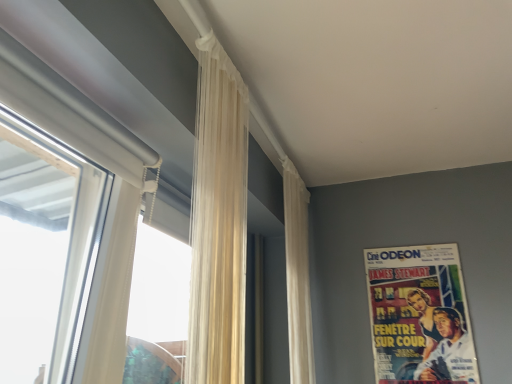
The height and width of the screenshot is (384, 512). Describe the element at coordinates (297, 276) in the screenshot. I see `white sheer curtain at upper center, which is the first curtain in right-to-left order` at that location.

This screenshot has width=512, height=384. I want to click on white matte window at left, so click(x=119, y=67).

Describe the element at coordinates (218, 221) in the screenshot. I see `translucent cream curtain at center, placed as the 1th curtain when sorted from front to back` at that location.

The image size is (512, 384). I want to click on translucent cream curtain at center, the first curtain positioned from the left, so click(x=218, y=221).

What do you see at coordinates (419, 315) in the screenshot? The height and width of the screenshot is (384, 512). I see `vintage paper poster at upper right` at bounding box center [419, 315].

The width and height of the screenshot is (512, 384). Find the location of `white sheer curtain at upper center, which is counted as the second curtain, starting from the left`. white sheer curtain at upper center, which is counted as the second curtain, starting from the left is located at coordinates (297, 276).

Visually, is vintage paper poster at upper right positioned to the left or to the right of white matte window at left?

vintage paper poster at upper right is positioned on white matte window at left's right side.

How far apart are vintage paper poster at upper right and white matte window at left?

vintage paper poster at upper right and white matte window at left are 1.19 meters apart.

Is vintage paper poster at upper right facing away from white matte window at left?

No.

Are vintage paper poster at upper right and white matte window at left beside each other?

No, vintage paper poster at upper right is not making contact with white matte window at left.

Considering the sizes of objects translucent cream curtain at center, the first curtain positioned from the left, and white matte window at left in the image provided, who is wider, translucent cream curtain at center, the first curtain positioned from the left, or white matte window at left?

white matte window at left.

From a real-world perspective, which curtain is the 2nd one above the white matte window at left? Please provide its 2D coordinates.

[(218, 221)]

Measure the distance between translucent cream curtain at center, the 2th curtain positioned from the right, and white matte window at left.

translucent cream curtain at center, the 2th curtain positioned from the right, and white matte window at left are 9.84 inches apart from each other.

Considering their positions, is translucent cream curtain at center, the first curtain positioned from the left, located in front of or behind white matte window at left?

Visually, translucent cream curtain at center, the first curtain positioned from the left, is located behind white matte window at left.

Between translucent cream curtain at center, the 2th curtain positioned from the right, and white sheer curtain at upper center, which is counted as the second curtain, starting from the left, which one has larger size?

white sheer curtain at upper center, which is counted as the second curtain, starting from the left.

Considering the sizes of objects translucent cream curtain at center, the first curtain positioned from the left, and white sheer curtain at upper center, which is counted as the second curtain, starting from the left, in the image provided, who is shorter, translucent cream curtain at center, the first curtain positioned from the left, or white sheer curtain at upper center, which is counted as the second curtain, starting from the left,?

With less height is translucent cream curtain at center, the first curtain positioned from the left.

Is translucent cream curtain at center, placed as the 1th curtain when sorted from front to back, to the left of white sheer curtain at upper center, positioned as the 1th curtain in back-to-front order, from the viewer's perspective?

Yes, translucent cream curtain at center, placed as the 1th curtain when sorted from front to back, is to the left of white sheer curtain at upper center, positioned as the 1th curtain in back-to-front order.

Is translucent cream curtain at center, the first curtain positioned from the left, directly adjacent to white sheer curtain at upper center, which is the first curtain in right-to-left order?

No, translucent cream curtain at center, the first curtain positioned from the left, is not next to white sheer curtain at upper center, which is the first curtain in right-to-left order.

Looking at this image, is white sheer curtain at upper center, which is counted as the second curtain, starting from the left, in front of or behind translucent cream curtain at center, placed as the 1th curtain when sorted from front to back, in the image?

white sheer curtain at upper center, which is counted as the second curtain, starting from the left, is behind translucent cream curtain at center, placed as the 1th curtain when sorted from front to back.

Which of these two, white sheer curtain at upper center, which is counted as the second curtain, starting from the left, or translucent cream curtain at center, the first curtain positioned from the left, is wider?

white sheer curtain at upper center, which is counted as the second curtain, starting from the left.

From a real-world perspective, which object rests below the other?

white sheer curtain at upper center, which is counted as the second curtain, starting from the left, is physically lower.

Between translucent cream curtain at center, placed as the 1th curtain when sorted from front to back, and vintage paper poster at upper right, which one has smaller width?

With smaller width is vintage paper poster at upper right.

Does point (224, 347) come behind point (429, 344)?

That is False.

Is translucent cream curtain at center, the first curtain positioned from the left, beside vintage paper poster at upper right?

No, translucent cream curtain at center, the first curtain positioned from the left, is not next to vintage paper poster at upper right.

From the picture: From the image's perspective, which object appears higher, translucent cream curtain at center, the first curtain positioned from the left, or vintage paper poster at upper right?

From the image's view, translucent cream curtain at center, the first curtain positioned from the left, is above.

Are white sheer curtain at upper center, which is counted as the second curtain, starting from the left, and vintage paper poster at upper right far apart?

Actually, white sheer curtain at upper center, which is counted as the second curtain, starting from the left, and vintage paper poster at upper right are a little close together.

You are a GUI agent. You are given a task and a screenshot of the screen. Output one action in this format:
    pyautogui.click(x=<x>, y=<y>)
    Task: Click on the 1st curtain in front of the vintage paper poster at upper right, starting your count from the anchor
    
    Given the screenshot: What is the action you would take?
    pyautogui.click(x=297, y=276)

Relative to vintage paper poster at upper right, is white sheer curtain at upper center, positioned as the 1th curtain in back-to-front order, in front or behind?

In the image, white sheer curtain at upper center, positioned as the 1th curtain in back-to-front order, appears in front of vintage paper poster at upper right.

How distant is white sheer curtain at upper center, which is counted as the second curtain, starting from the left, from vintage paper poster at upper right?

A distance of 44.12 centimeters exists between white sheer curtain at upper center, which is counted as the second curtain, starting from the left, and vintage paper poster at upper right.

In terms of height, does white sheer curtain at upper center, which ranks as the second curtain in front-to-back order, look taller or shorter compared to white matte window at left?

white sheer curtain at upper center, which ranks as the second curtain in front-to-back order, is taller than white matte window at left.

Is white sheer curtain at upper center, which is counted as the second curtain, starting from the left, with white matte window at left?

No, white sheer curtain at upper center, which is counted as the second curtain, starting from the left, is not with white matte window at left.

Based on the photo, from the image's perspective, is white sheer curtain at upper center, which is counted as the second curtain, starting from the left, on white matte window at left?

No, from the image's perspective, white sheer curtain at upper center, which is counted as the second curtain, starting from the left, is not on top of white matte window at left.

Based on the photo, does white sheer curtain at upper center, which is counted as the second curtain, starting from the left, appear on the right side of white matte window at left?

Correct, you'll find white sheer curtain at upper center, which is counted as the second curtain, starting from the left, to the right of white matte window at left.

Find the location of a particular element. The image size is (512, 384). window that is above the vintage paper poster at upper right (from a real-world perspective) is located at coordinates (119, 67).

Where is `curtain that is above the white matte window at left (from the image's perspective)`? The image size is (512, 384). curtain that is above the white matte window at left (from the image's perspective) is located at coordinates (218, 221).

Estimate the real-world distances between objects in this image. Which object is closer to translucent cream curtain at center, the second curtain viewed from the back, white sheer curtain at upper center, which is the first curtain in right-to-left order, or vintage paper poster at upper right?

The object closer to translucent cream curtain at center, the second curtain viewed from the back, is white sheer curtain at upper center, which is the first curtain in right-to-left order.

Estimate the real-world distances between objects in this image. Which object is closer to white sheer curtain at upper center, which is counted as the second curtain, starting from the left, white matte window at left or vintage paper poster at upper right?

Among the two, vintage paper poster at upper right is located nearer to white sheer curtain at upper center, which is counted as the second curtain, starting from the left.

From the image, which object appears to be nearer to white sheer curtain at upper center, which ranks as the second curtain in front-to-back order, white matte window at left or translucent cream curtain at center, the first curtain positioned from the left?

Among the two, translucent cream curtain at center, the first curtain positioned from the left, is located nearer to white sheer curtain at upper center, which ranks as the second curtain in front-to-back order.

From the image, which object appears to be nearer to white matte window at left, vintage paper poster at upper right or white sheer curtain at upper center, positioned as the 1th curtain in back-to-front order?

Based on the image, white sheer curtain at upper center, positioned as the 1th curtain in back-to-front order, appears to be nearer to white matte window at left.

In the scene shown: When comparing their distances from vintage paper poster at upper right, does white sheer curtain at upper center, positioned as the 1th curtain in back-to-front order, or translucent cream curtain at center, the 2th curtain positioned from the right, seem closer?

white sheer curtain at upper center, positioned as the 1th curtain in back-to-front order, is closer to vintage paper poster at upper right.

In the scene shown: Which object lies nearer to the anchor point white sheer curtain at upper center, which ranks as the second curtain in front-to-back order, translucent cream curtain at center, the first curtain positioned from the left, or vintage paper poster at upper right?

vintage paper poster at upper right is positioned closer to the anchor white sheer curtain at upper center, which ranks as the second curtain in front-to-back order.

Based on their spatial positions, is vintage paper poster at upper right or white matte window at left closer to white sheer curtain at upper center, which is the first curtain in right-to-left order?

The object closer to white sheer curtain at upper center, which is the first curtain in right-to-left order, is vintage paper poster at upper right.

Looking at the image, which one is located further to white sheer curtain at upper center, which is counted as the second curtain, starting from the left, vintage paper poster at upper right or translucent cream curtain at center, the first curtain positioned from the left?

Based on the image, translucent cream curtain at center, the first curtain positioned from the left, appears to be further to white sheer curtain at upper center, which is counted as the second curtain, starting from the left.

The image size is (512, 384). I want to click on curtain positioned between white matte window at left and white sheer curtain at upper center, which is counted as the second curtain, starting from the left, from near to far, so click(x=218, y=221).

Locate an element on the screen. The image size is (512, 384). curtain located between translucent cream curtain at center, placed as the 1th curtain when sorted from front to back, and vintage paper poster at upper right in the depth direction is located at coordinates (297, 276).